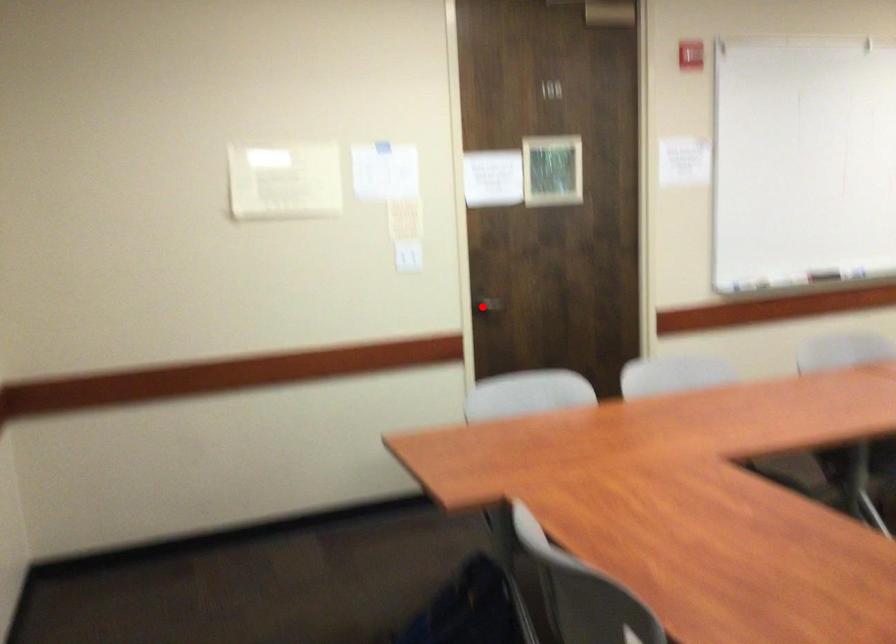
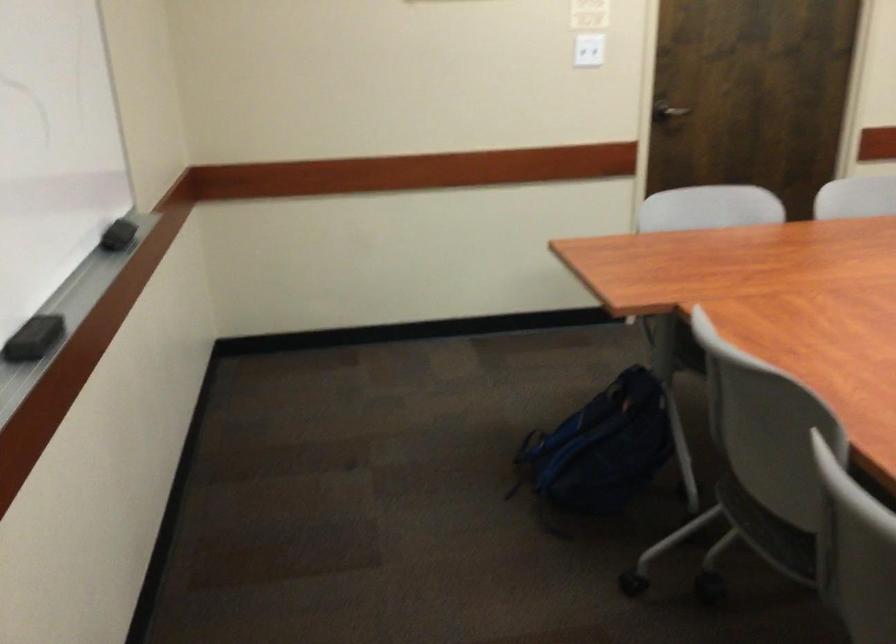
Question: A red point is marked in image1. In image2, is the corresponding 3D point closer to the camera or farther? Reply with the corresponding letter.

Choices:
 (A) The corresponding 3D point is closer.
 (B) The corresponding 3D point is farther.

Answer: (A)